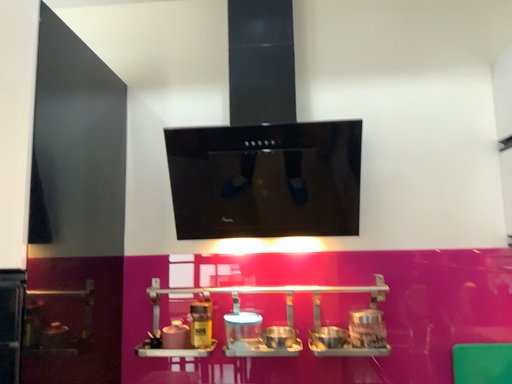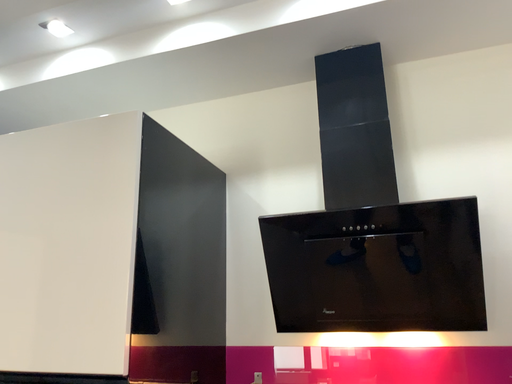
Question: How did the camera likely rotate when shooting the video?

Choices:
 (A) rotated left
 (B) rotated right

Answer: (A)